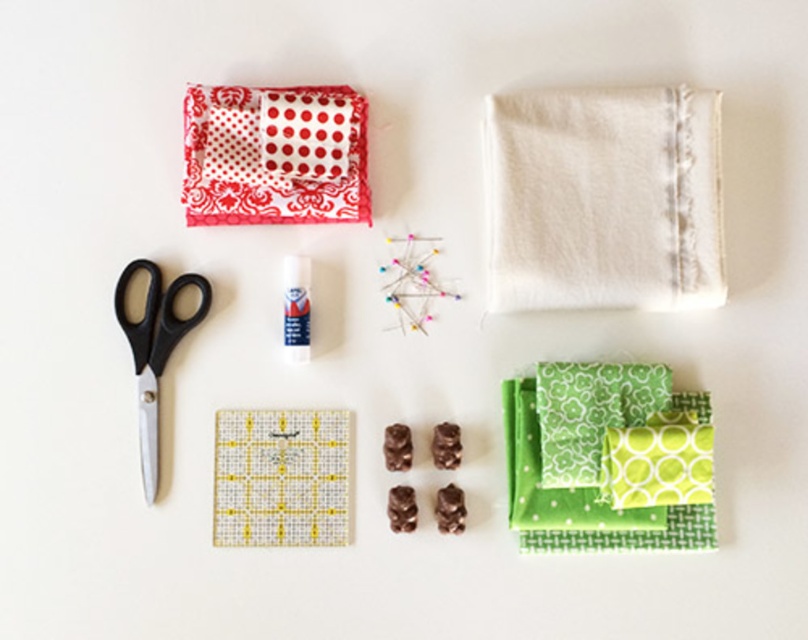
You are organizing a craft station and need to place a new tool between the white cotton cloth at upper right and the green fabric at center right. Given that the tool requires 7 inches of space to fit comfortably, will there be enough space between these two items?

The white cotton cloth at upper right and green fabric at center right are 6.73 inches apart from each other. Since the required space is 7 inches, there is not enough space to place the tool comfortably between them.

You are standing 5 feet away from the white cotton cloth at upper right. Can you reach it without moving your feet?

The white cotton cloth at upper right is 3.82 feet away from the camera. Since you are standing 5 feet away from it, you cannot reach it without moving your feet.

You are organizing a craft kit and need to know the sizes of items. Which object is larger in size between the white cotton cloth at upper right and the black plastic scissors at left?

The white cotton cloth at upper right is bigger than the black plastic scissors at left according to the description.